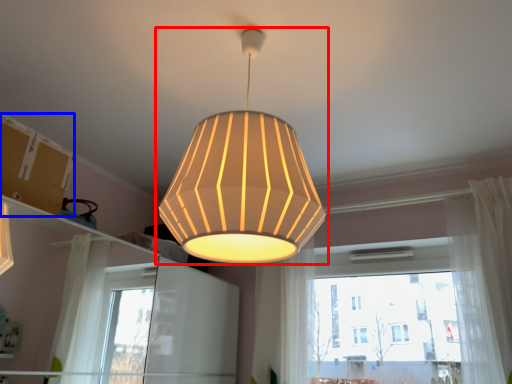
Question: Among these objects, which one is farthest to the camera, lamp (highlighted by a red box) or cardboard box (highlighted by a blue box)?

Choices:
 (A) lamp
 (B) cardboard box

Answer: (B)